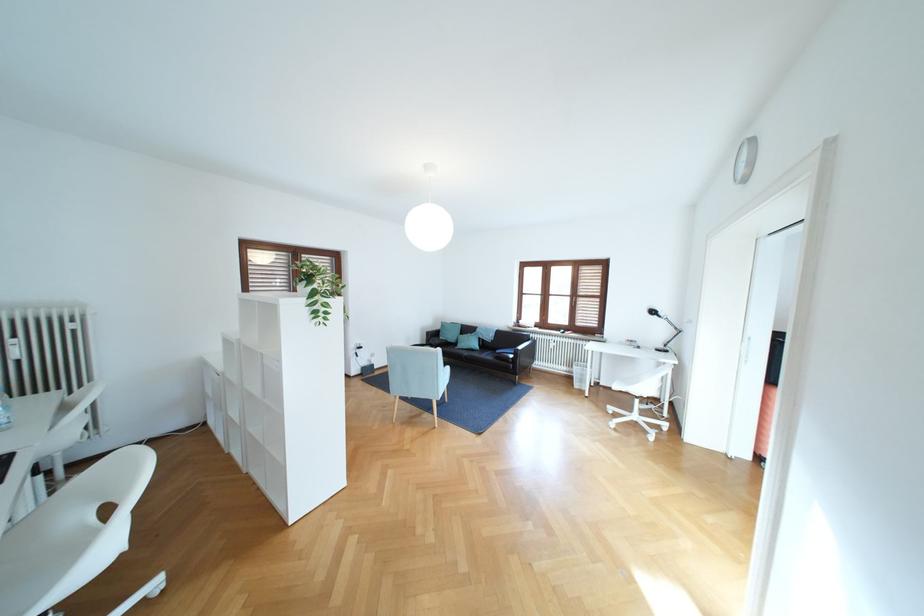
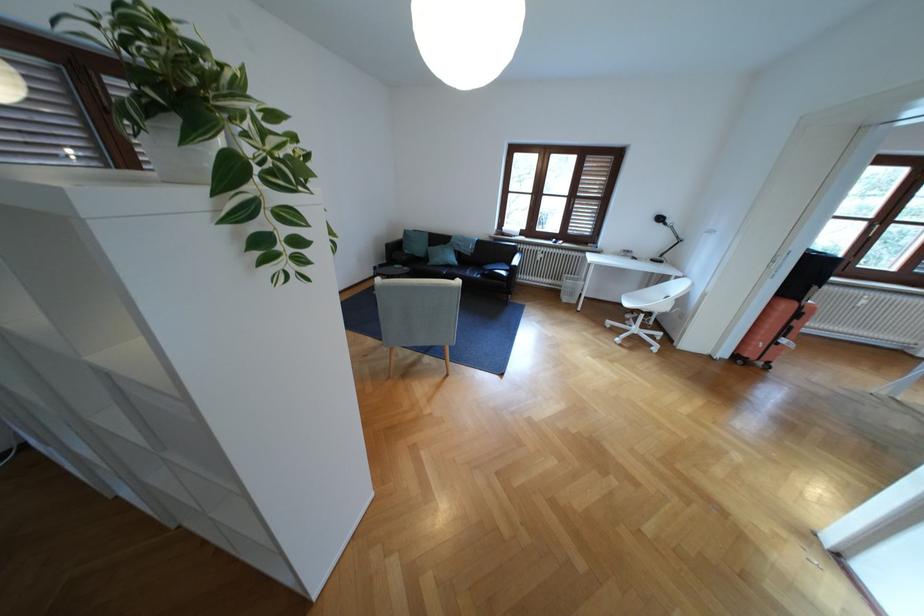
Locate, in the second image, the point that corresponds to (x=451, y=339) in the first image.

(417, 252)